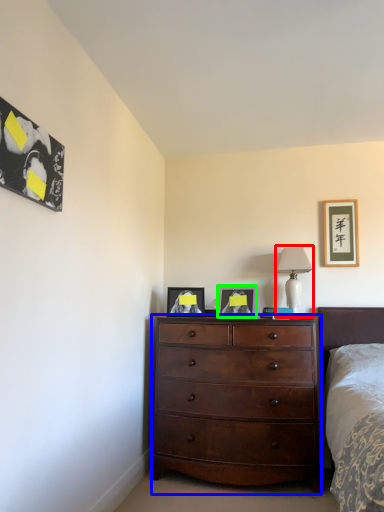
Question: Which is farther away from table lamp (highlighted by a red box)? chest of drawers (highlighted by a blue box) or picture frame (highlighted by a green box)?

Choices:
 (A) chest of drawers
 (B) picture frame

Answer: (A)